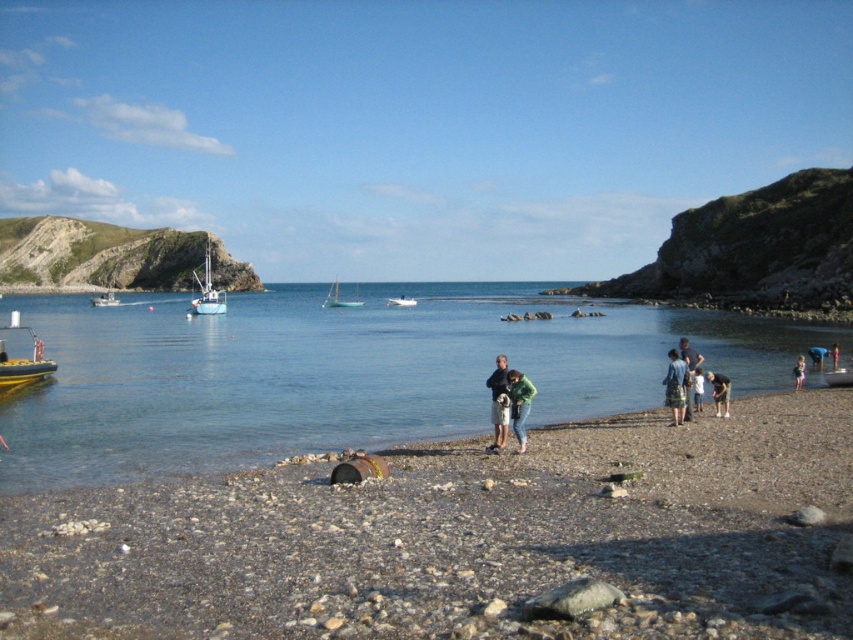
You are a swimmer standing on the pebbled beach and want to enter the water. The clear blue water at center and the light blue denim shorts at lower right are in your view. Which one is closer to the water?

The clear blue water at center is closer to the water than the light blue denim shorts at lower right because it is taller than the shorts.

Looking at this image, you are a photographer trying to capture the clear blue water at center and the light blue denim shorts at lower right in the same frame. Which object should you focus on first to ensure both are in the frame without moving the camera?

You should focus on the clear blue water at center first because it is larger and will be easier to frame initially, allowing the smaller light blue denim shorts at lower right to fit into the composition without needing to adjust the camera position.